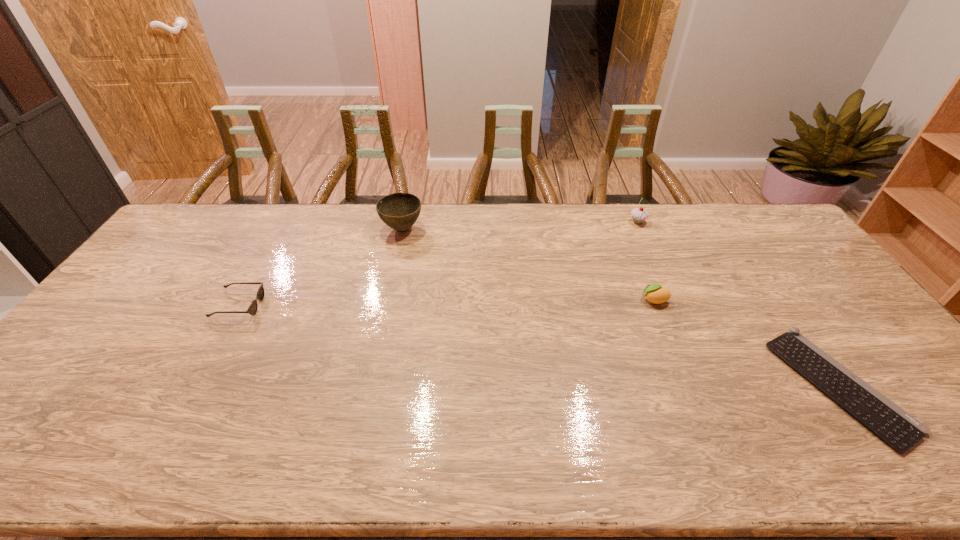
I want to click on vacant area between the rightmost object and the lemon, so click(x=746, y=343).

Find the location of a particular element. The image size is (960, 540). free space between the shortest object and the cupcake is located at coordinates (738, 304).

Identify the location of object that is the closest to the lemon. (899, 429).

Where is `the fourth closest object to the second object from left to right`? The image size is (960, 540). the fourth closest object to the second object from left to right is located at coordinates (899, 429).

Where is `vacant space that satisfies the following two spatial constraints: 1. with leaves positioned above the shortest object; 2. on the right side of the lemon`? The height and width of the screenshot is (540, 960). vacant space that satisfies the following two spatial constraints: 1. with leaves positioned above the shortest object; 2. on the right side of the lemon is located at coordinates (688, 386).

Where is `free space that satisfies the following two spatial constraints: 1. on the front side of the cupcake; 2. on the left side of the shortest object`? free space that satisfies the following two spatial constraints: 1. on the front side of the cupcake; 2. on the left side of the shortest object is located at coordinates (710, 386).

At what (x,y) coordinates should I click in order to perform the action: click on free location that satisfies the following two spatial constraints: 1. on the front side of the shortest object; 2. on the right side of the cupcake. Please return your answer as a coordinate pair (x, y). Looking at the image, I should click on (710, 386).

The image size is (960, 540). What are the coordinates of `vacant space that satisfies the following two spatial constraints: 1. on the front lenses of the sunglasses; 2. on the back side of the computer keyboard` in the screenshot? It's located at (195, 386).